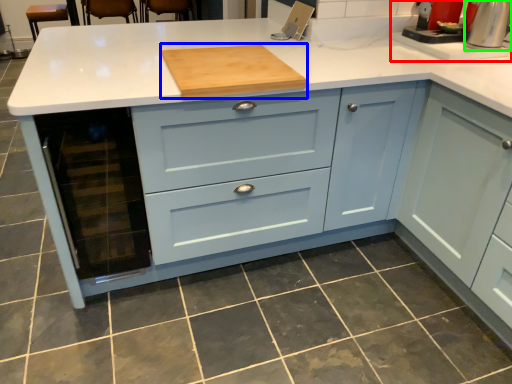
Question: Estimate the real-world distances between objects in this image. Which object is closer to sink (highlighted by a red box), kitchen appliance (highlighted by a blue box) or home appliance (highlighted by a green box)?

Choices:
 (A) kitchen appliance
 (B) home appliance

Answer: (B)